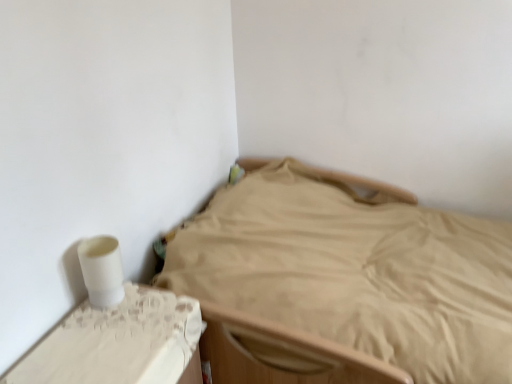
Question: From a real-world perspective, is beige fabric bed at center on top of white lace table at lower left?

Choices:
 (A) yes
 (B) no

Answer: (B)

Question: Is beige fabric bed at center wider than white lace table at lower left?

Choices:
 (A) yes
 (B) no

Answer: (A)

Question: Considering the relative sizes of beige fabric bed at center and white lace table at lower left in the image provided, is beige fabric bed at center bigger than white lace table at lower left?

Choices:
 (A) yes
 (B) no

Answer: (A)

Question: Is beige fabric bed at center at the left side of white lace table at lower left?

Choices:
 (A) no
 (B) yes

Answer: (A)

Question: Considering the relative sizes of beige fabric bed at center and white lace table at lower left in the image provided, is beige fabric bed at center thinner than white lace table at lower left?

Choices:
 (A) yes
 (B) no

Answer: (B)

Question: Considering the relative sizes of beige fabric bed at center and white lace table at lower left in the image provided, is beige fabric bed at center taller than white lace table at lower left?

Choices:
 (A) no
 (B) yes

Answer: (B)

Question: From the image's perspective, is white lace table at lower left under beige fabric bed at center?

Choices:
 (A) yes
 (B) no

Answer: (A)

Question: Is white lace table at lower left next to beige fabric bed at center and touching it?

Choices:
 (A) no
 (B) yes

Answer: (A)

Question: Considering the relative sizes of white lace table at lower left and beige fabric bed at center in the image provided, is white lace table at lower left smaller than beige fabric bed at center?

Choices:
 (A) yes
 (B) no

Answer: (A)

Question: Is white lace table at lower left oriented away from beige fabric bed at center?

Choices:
 (A) yes
 (B) no

Answer: (B)

Question: Is white lace table at lower left positioned beyond the bounds of beige fabric bed at center?

Choices:
 (A) no
 (B) yes

Answer: (B)

Question: From a real-world perspective, is white lace table at lower left over beige fabric bed at center?

Choices:
 (A) no
 (B) yes

Answer: (B)

Question: From the image's perspective, is beige fabric bed at center positioned above or below white lace table at lower left?

Choices:
 (A) above
 (B) below

Answer: (A)